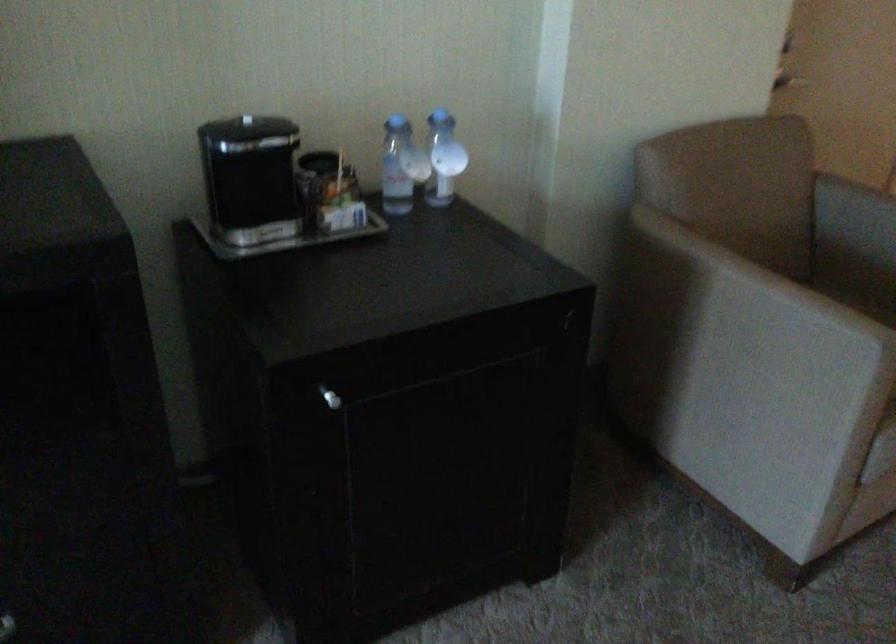
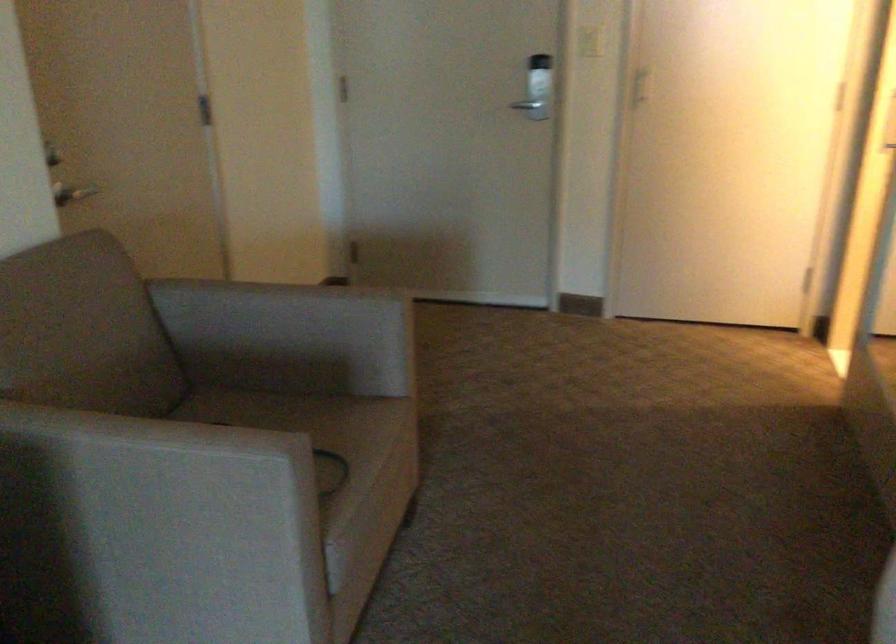
Question: The images are taken continuously from a first-person perspective. In which direction is your viewpoint rotating?

Choices:
 (A) Left
 (B) Right
 (C) Up
 (D) Down

Answer: (B)